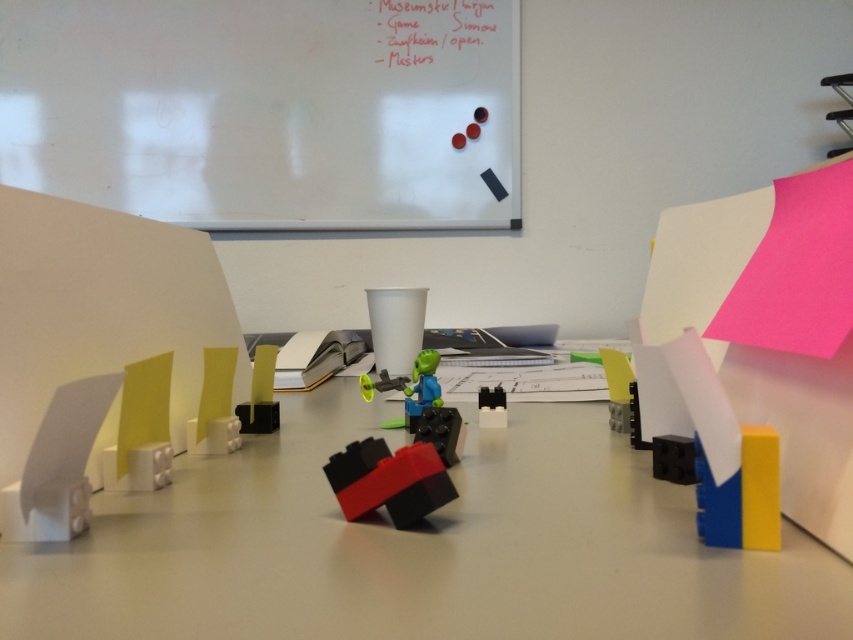
Question: Is white paper at upper center wider than shiny plastic alien at center?

Choices:
 (A) yes
 (B) no

Answer: (A)

Question: Among these points, which one is farthest from the camera?

Choices:
 (A) pos(442,49)
 (B) pos(395,422)

Answer: (A)

Question: Is whiteboard at upper center to the left of black plastic blocks at center from the viewer's perspective?

Choices:
 (A) no
 (B) yes

Answer: (B)

Question: Among these points, which one is farthest from the camera?

Choices:
 (A) (671, 572)
 (B) (431, 380)

Answer: (B)

Question: Does brick-like plastic blocks at center come behind shiny plastic alien at center?

Choices:
 (A) yes
 (B) no

Answer: (B)

Question: Which of the following is the farthest from the observer?

Choices:
 (A) (363, 465)
 (B) (424, 388)

Answer: (B)